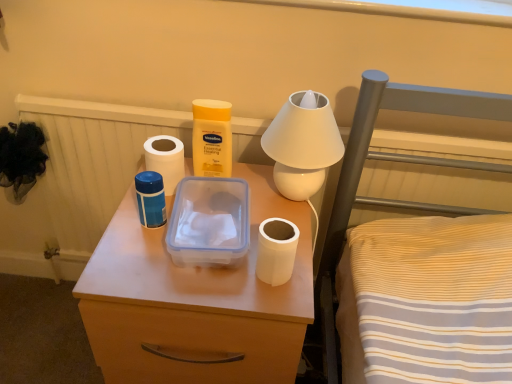
Identify the location of vacant area that is in front of transparent plastic lunch box at center. The height and width of the screenshot is (384, 512). (201, 295).